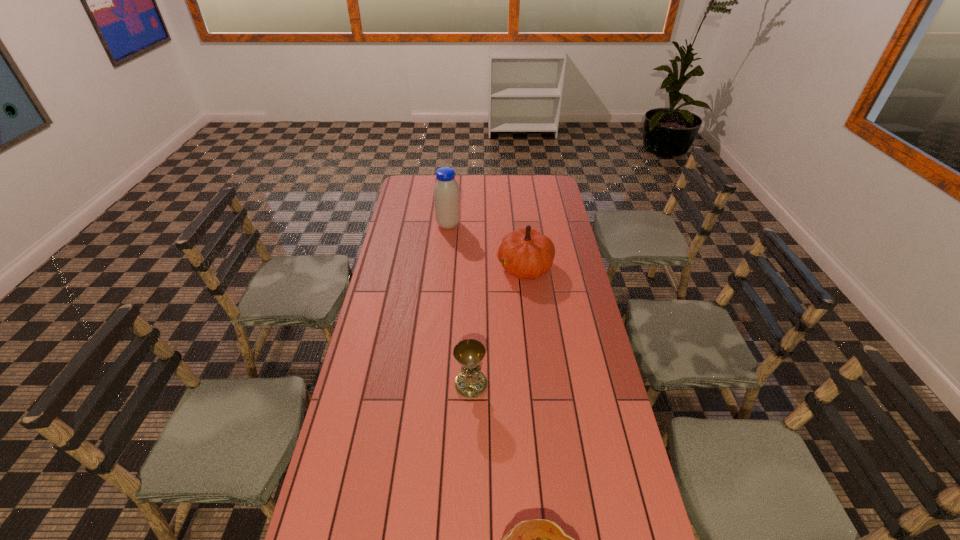
Where is `vacant space situated 0.400m on the front of the third object from right to left`? Image resolution: width=960 pixels, height=540 pixels. vacant space situated 0.400m on the front of the third object from right to left is located at coordinates (468, 536).

Identify the location of object located in the right edge section of the desktop. (527, 254).

At what (x,y) coordinates should I click in order to perform the action: click on free location at the far edge. Please return your answer as a coordinate pair (x, y). Looking at the image, I should click on (484, 188).

This screenshot has height=540, width=960. Find the location of `vacant space at the left edge of the desktop`. vacant space at the left edge of the desktop is located at coordinates (407, 208).

Find the location of a particular element. The height and width of the screenshot is (540, 960). vacant area at the right edge is located at coordinates pyautogui.click(x=603, y=408).

Identify the location of free space at the far left corner of the desktop. The width and height of the screenshot is (960, 540). (423, 178).

This screenshot has width=960, height=540. Find the location of `vacant space that is in between the third object from right to left and the leftmost object`. vacant space that is in between the third object from right to left and the leftmost object is located at coordinates (460, 305).

Find the location of `free space between the second tallest object and the soya milk`. free space between the second tallest object and the soya milk is located at coordinates (487, 246).

Where is `free space between the second farthest object and the soya milk`? The height and width of the screenshot is (540, 960). free space between the second farthest object and the soya milk is located at coordinates (487, 246).

What are the coordinates of `vacant space that's between the third nearest object and the third object from right to left` in the screenshot? It's located at (498, 326).